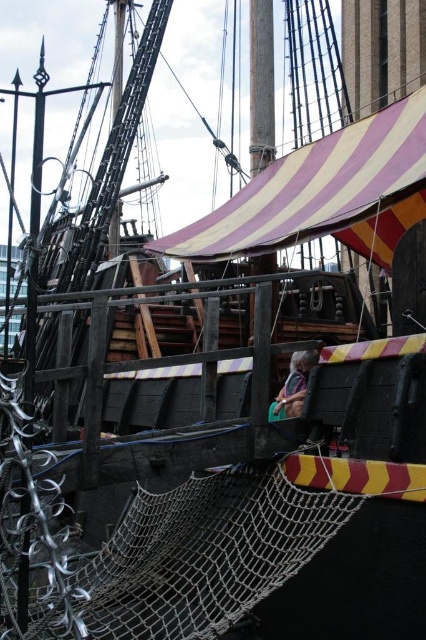
Question: Which of the following is the farthest from the observer?

Choices:
 (A) striped canvas canopy at upper center
 (B) green fabric bag at center

Answer: (B)

Question: Can you confirm if striped canvas canopy at upper center is positioned above green fabric bag at center?

Choices:
 (A) no
 (B) yes

Answer: (B)

Question: Is striped canvas canopy at upper center below green fabric bag at center?

Choices:
 (A) no
 (B) yes

Answer: (A)

Question: Does striped canvas canopy at upper center have a greater width compared to green fabric bag at center?

Choices:
 (A) no
 (B) yes

Answer: (B)

Question: Among these points, which one is farthest from the camera?

Choices:
 (A) (273, 237)
 (B) (284, 413)

Answer: (B)

Question: Among these objects, which one is nearest to the camera?

Choices:
 (A) green fabric bag at center
 (B) striped canvas canopy at upper center

Answer: (B)